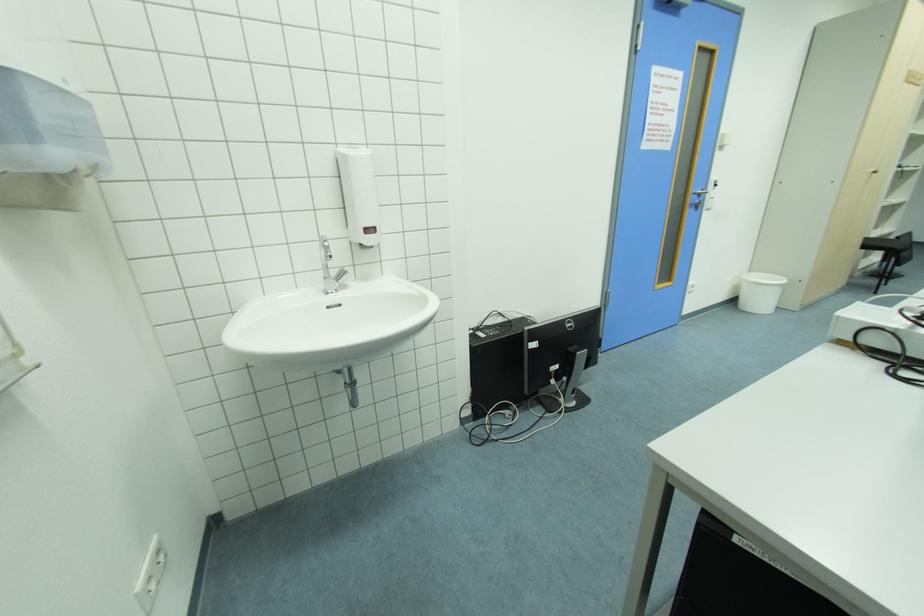
Where is `dispenser push lever`? dispenser push lever is located at coordinates (369, 236).